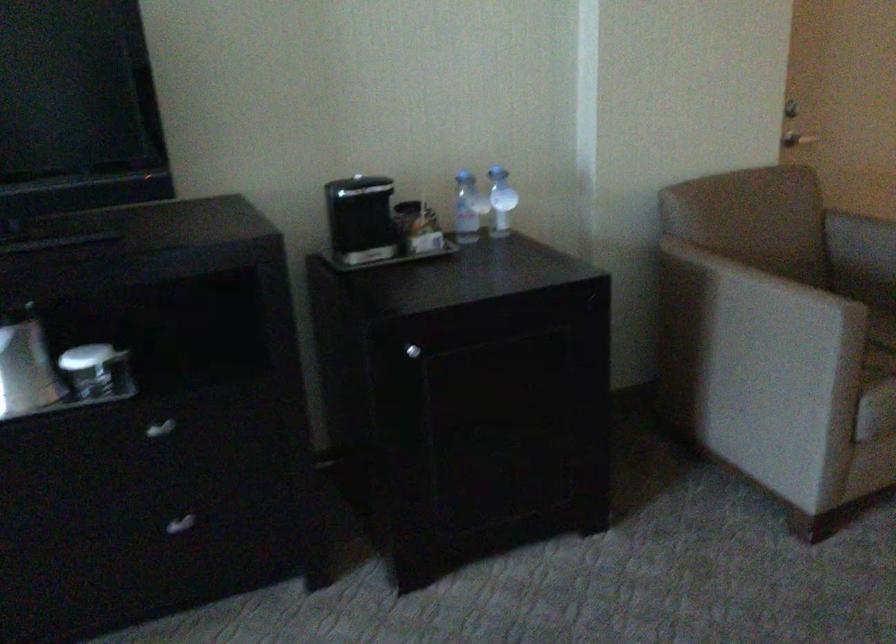
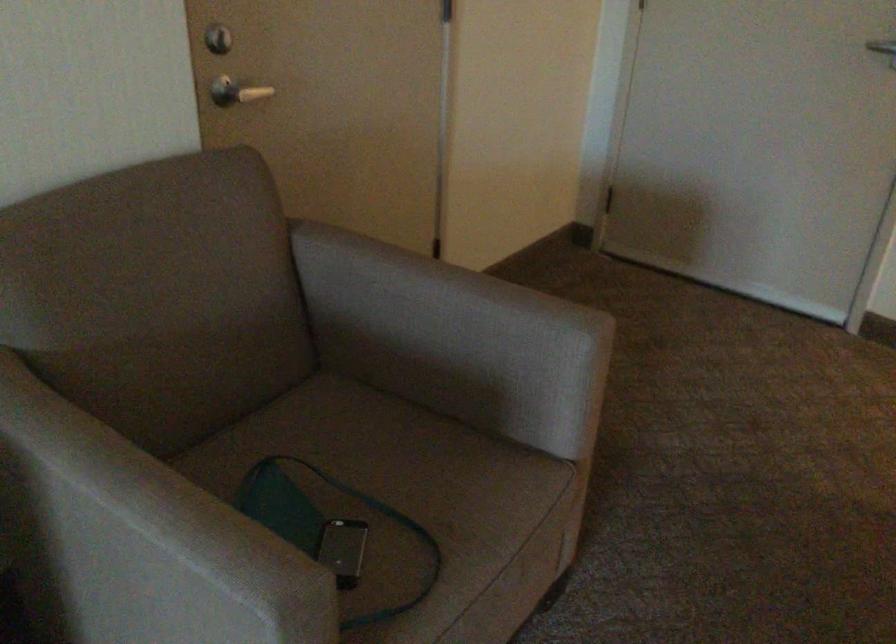
Question: I am providing you with two images of the same scene from different viewpoints. After the viewpoint changes to image2, which objects are now occluded?

Choices:
 (A) silver door handle
 (B) chair sitting surface
 (C) door lock
 (D) none of these

Answer: (D)